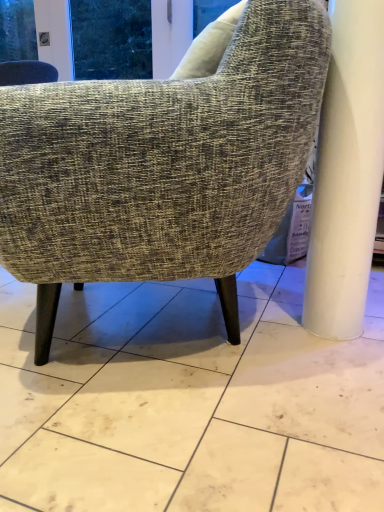
Find the location of `white marble floor at center`. white marble floor at center is located at coordinates (189, 401).

The image size is (384, 512). What do you see at coordinates (189, 401) in the screenshot? I see `white marble floor at center` at bounding box center [189, 401].

In order to face white marble floor at center, should I rotate leftwards or rightwards?

To align with it, rotate left about 5.372°.

Describe the element at coordinates (161, 166) in the screenshot. I see `textured gray fabric chair at center` at that location.

The image size is (384, 512). Find the location of `textured gray fabric chair at center`. textured gray fabric chair at center is located at coordinates (161, 166).

The height and width of the screenshot is (512, 384). Identify the location of white marble floor at center. (189, 401).

Between textured gray fabric chair at center and white marble floor at center, which one appears on the left side from the viewer's perspective?

From the viewer's perspective, white marble floor at center appears more on the left side.

Is the position of textured gray fabric chair at center more distant than that of white marble floor at center?

Yes, textured gray fabric chair at center is further from the camera.

Considering the points (17, 197) and (238, 370), which point is behind, point (17, 197) or point (238, 370)?

The point (238, 370) is farther from the camera.

From the image's perspective, would you say textured gray fabric chair at center is shown under white marble floor at center?

No, from the image's perspective, textured gray fabric chair at center is not below white marble floor at center.

From a real-world perspective, is textured gray fabric chair at center on white marble floor at center?

Indeed, from a real-world perspective, textured gray fabric chair at center stands above white marble floor at center.

Which of these two, textured gray fabric chair at center or white marble floor at center, is wider?

white marble floor at center is wider.

Who is shorter, textured gray fabric chair at center or white marble floor at center?

With less height is white marble floor at center.

Considering the sizes of textured gray fabric chair at center and white marble floor at center in the image, is textured gray fabric chair at center bigger or smaller than white marble floor at center?

Clearly, textured gray fabric chair at center is larger in size than white marble floor at center.

Which is correct: textured gray fabric chair at center is inside white marble floor at center, or outside of it?

textured gray fabric chair at center is not enclosed by white marble floor at center.

Is the surface of textured gray fabric chair at center in direct contact with white marble floor at center?

No.

Is textured gray fabric chair at center facing away from white marble floor at center?

No.

The height and width of the screenshot is (512, 384). Identify the location of chair lying behind the white marble floor at center. (161, 166).

Is white marble floor at center at the left side of textured gray fabric chair at center?

Yes, white marble floor at center is to the left of textured gray fabric chair at center.

Is the position of white marble floor at center less distant than that of textured gray fabric chair at center?

Answer: Yes, white marble floor at center is in front of textured gray fabric chair at center.

Is point (39, 504) more distant than point (43, 315)?

That is False.

From the image's perspective, would you say white marble floor at center is positioned over textured gray fabric chair at center?

Actually, white marble floor at center appears below textured gray fabric chair at center in the image.

From a real-world perspective, who is located higher, white marble floor at center or textured gray fabric chair at center?

textured gray fabric chair at center is physically above.

Considering the sizes of objects white marble floor at center and textured gray fabric chair at center in the image provided, who is thinner, white marble floor at center or textured gray fabric chair at center?

textured gray fabric chair at center.

Considering the relative sizes of white marble floor at center and textured gray fabric chair at center in the image provided, is white marble floor at center taller than textured gray fabric chair at center?

No, white marble floor at center is not taller than textured gray fabric chair at center.

Is white marble floor at center smaller than textured gray fabric chair at center?

Yes, white marble floor at center is smaller than textured gray fabric chair at center.

Is white marble floor at center outside of textured gray fabric chair at center?

white marble floor at center is positioned outside textured gray fabric chair at center.

Is white marble floor at center positioned far away from textured gray fabric chair at center?

No, there isn't a large distance between white marble floor at center and textured gray fabric chair at center.

Does white marble floor at center turn towards textured gray fabric chair at center?

Yes, white marble floor at center is aimed at textured gray fabric chair at center.

What's the angular difference between white marble floor at center and textured gray fabric chair at center's facing directions?

The angular difference between white marble floor at center and textured gray fabric chair at center is 68.6 degrees.

The image size is (384, 512). In the image, there is a white marble floor at center. In order to click on chair above it (from the image's perspective) in this screenshot , I will do click(x=161, y=166).

Locate an element on the screen. concrete on the left of textured gray fabric chair at center is located at coordinates (189, 401).

Locate an element on the screen. The image size is (384, 512). chair located behind the white marble floor at center is located at coordinates (161, 166).